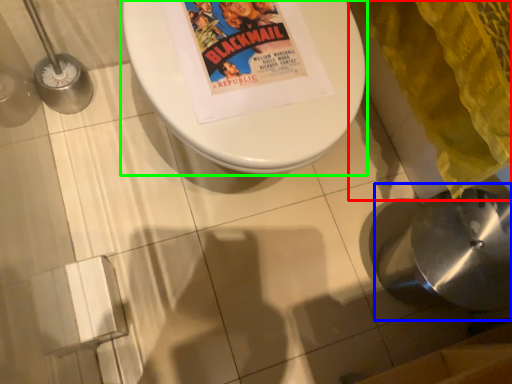
Question: Which object is positioned farthest from blanket (highlighted by a red box)? Select from sink (highlighted by a blue box) and toilet (highlighted by a green box).

Choices:
 (A) sink
 (B) toilet

Answer: (B)